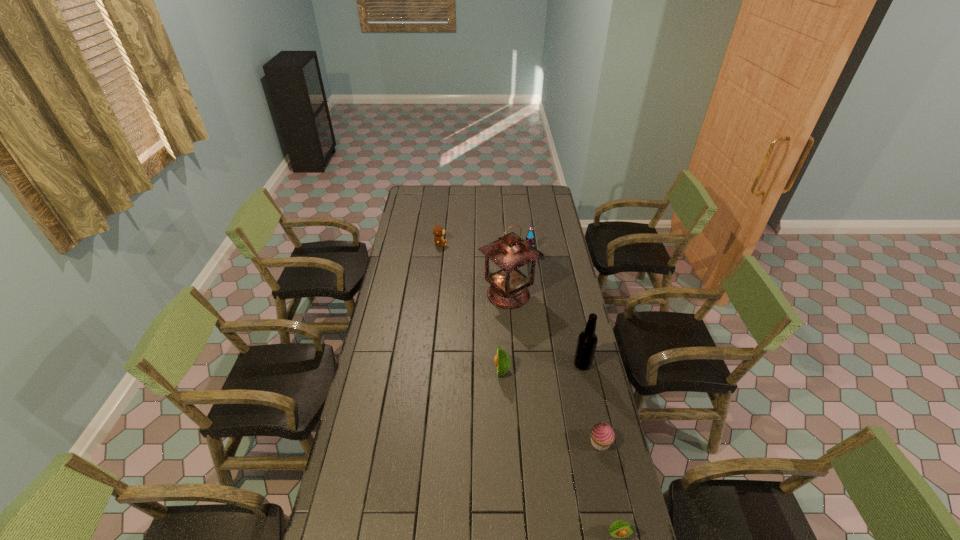
This screenshot has width=960, height=540. What are the coordinates of `free space for a new avocado on the left` in the screenshot? It's located at (433, 274).